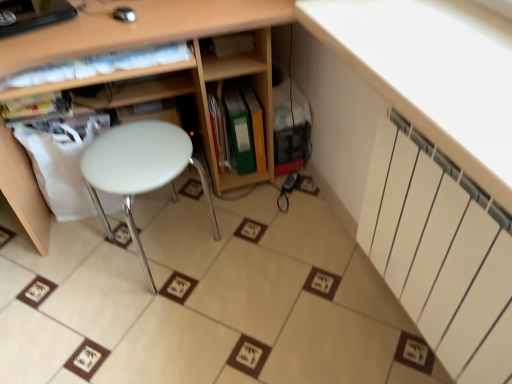
Identify the location of blank space above white plastic stool at center (from a real-world perspective). (134, 156).